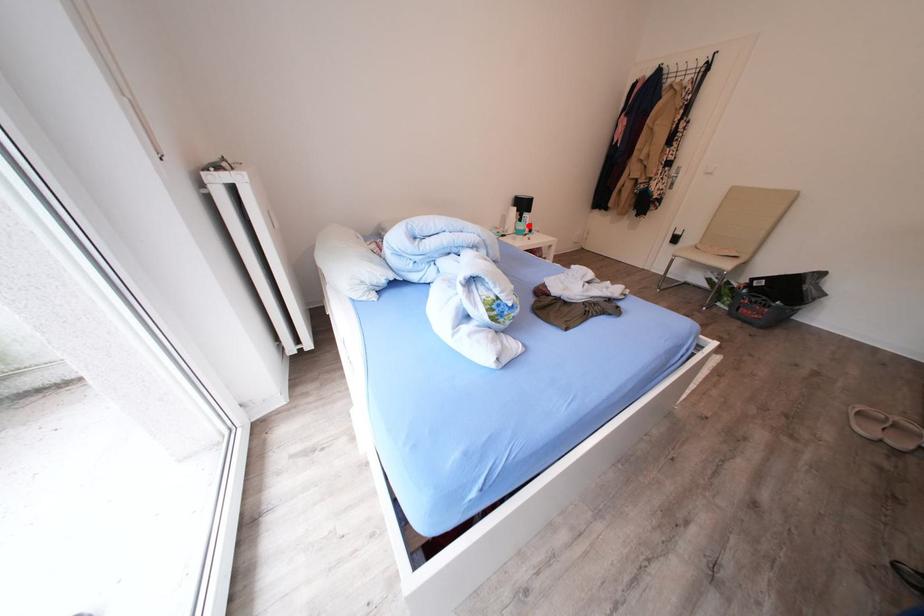
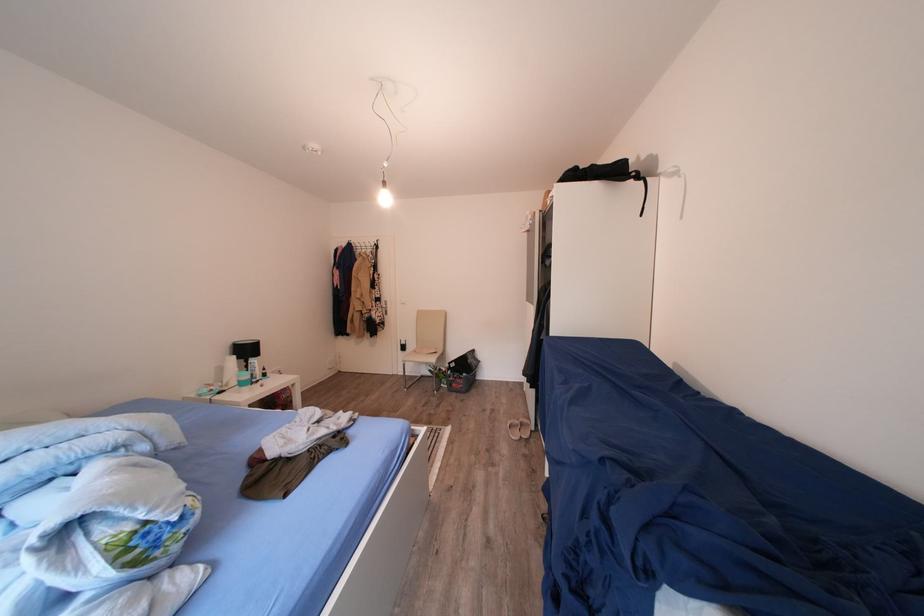
Question: I am providing you with two images of the same scene from different viewpoints. A red point is marked on the first image. Is the red point's position out of view in image 2?

Choices:
 (A) Yes
 (B) No

Answer: (B)